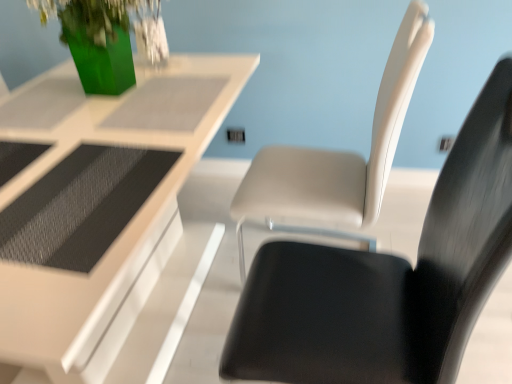
Question: From the image's perspective, is white glossy table at upper center located above or below matte white chair at center, positioned as the first chair in front-to-back order?

Choices:
 (A) below
 (B) above

Answer: (B)

Question: Considering the positions of point (86, 347) and point (233, 349), is point (86, 347) closer or farther from the camera than point (233, 349)?

Choices:
 (A) closer
 (B) farther

Answer: (B)

Question: Which object is the farthest from the white glossy table at upper center?

Choices:
 (A) matte white chair at center, acting as the 2th chair starting from the front
 (B) matte white chair at center, positioned as the first chair in front-to-back order

Answer: (B)

Question: Which is nearer to the matte white chair at center, positioned as the first chair in front-to-back order?

Choices:
 (A) white glossy table at upper center
 (B) matte white chair at center, acting as the 2th chair starting from the front

Answer: (B)